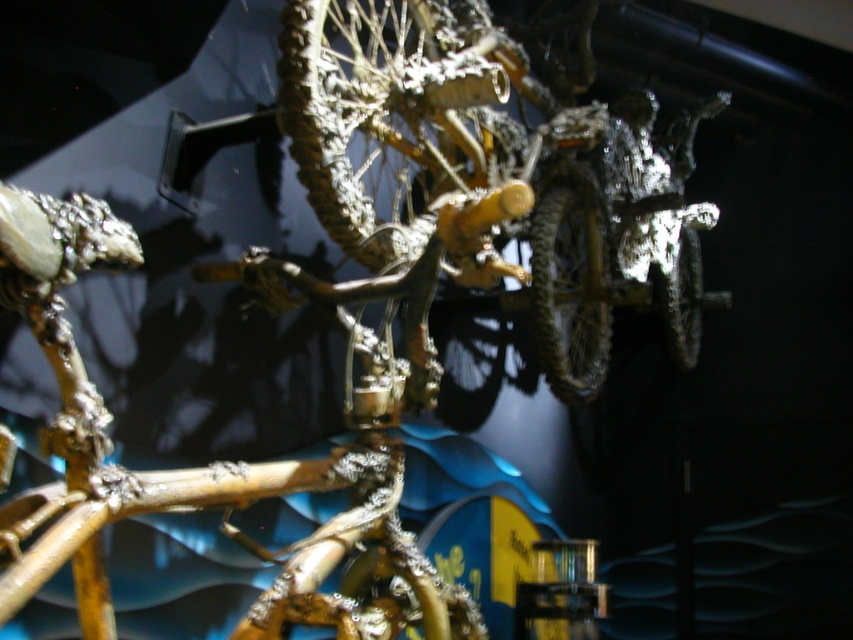
Who is more distant from viewer, (578,189) or (680,369)?

Point (680,369)

Is metallic gold tire at center taller than metallic silver tire at right?

Correct, metallic gold tire at center is much taller as metallic silver tire at right.

Which is behind, point (582, 241) or point (677, 349)?

The point (677, 349) is behind.

Identify the location of metallic gold tire at center. (569, 292).

Between gold metallic bicycle at center and metallic gold bicycle tire at upper center, which one has less height?

Standing shorter between the two is metallic gold bicycle tire at upper center.

Is gold metallic bicycle at center thinner than metallic gold bicycle tire at upper center?

Incorrect, gold metallic bicycle at center's width is not less than metallic gold bicycle tire at upper center's.

This screenshot has height=640, width=853. Find the location of `gold metallic bicycle at center`. gold metallic bicycle at center is located at coordinates (480, 173).

Between point (419, 202) and point (677, 324), which one is positioned behind?

Positioned behind is point (677, 324).

Between metallic gold bicycle tire at upper center and metallic silver tire at right, which one appears on the right side from the viewer's perspective?

metallic silver tire at right

Between point (346, 81) and point (699, 252), which one is positioned behind?

Point (699, 252)

Find the location of `metallic gold bicycle tire at upper center`. metallic gold bicycle tire at upper center is located at coordinates (357, 120).